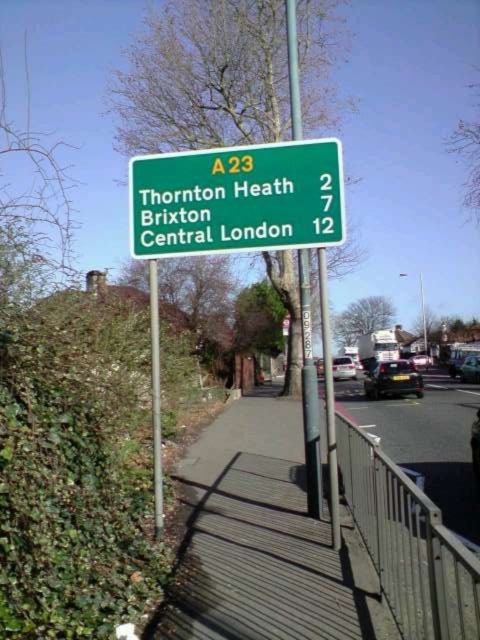
Consider the image. You are standing on the pedestrian bridge and looking at the road sign and the hedge. Which of the two points, point (416, 454) or point (290, 35), is closer to you?

Point (290, 35) is closer to you because it is less further to the camera than point (416, 454).

You are standing at the edge of the dark gray wooden pavement at center and want to cross to the other side. If your walking speed is 1.5 meters per second, how many seconds will it take you to reach the other side?

The dark gray wooden pavement at center and viewer are 4.19 meters apart from each other. Since you are starting at the edge, the distance to cross is approximately half of that, so around 2.095 meters. At 1.5 meters per second, it would take roughly 1.4 seconds.

You are a delivery person carrying a heavy box and need to cross the pedestrian bridge. The dark gray wooden pavement at center is where you will walk. Is the metallic gray railing at lower right wide enough for you to hold onto while crossing?

The dark gray wooden pavement at center has a larger size compared to metallic gray railing at lower right, so the metallic gray railing at lower right may not be wide enough for you to hold onto comfortably while crossing the bridge.